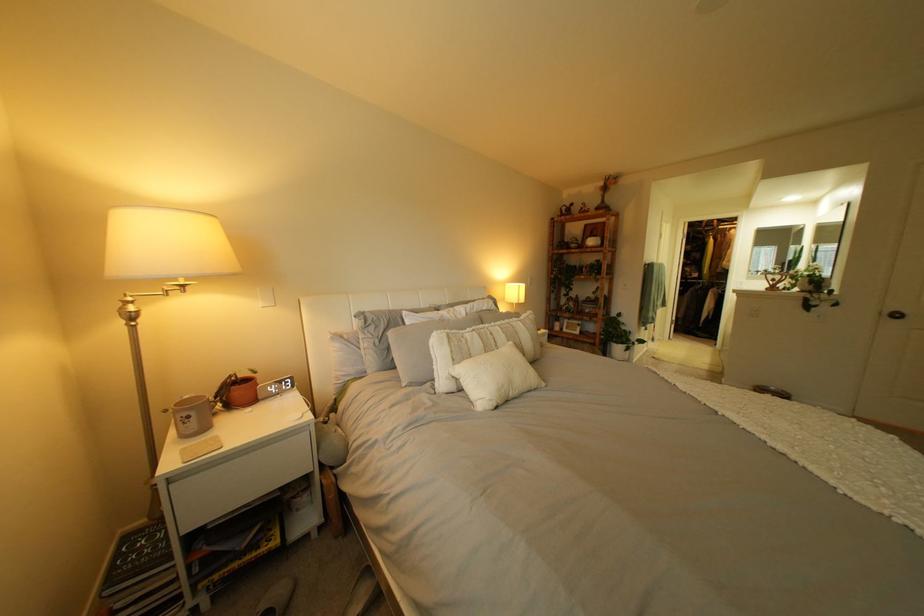
Describe the element at coordinates (247, 459) in the screenshot. I see `a nightstand drawer edge` at that location.